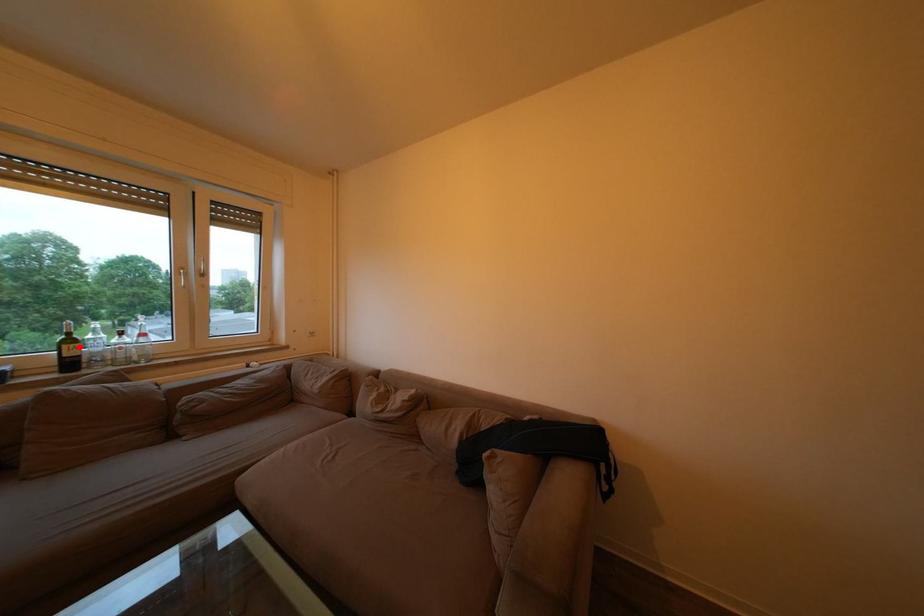
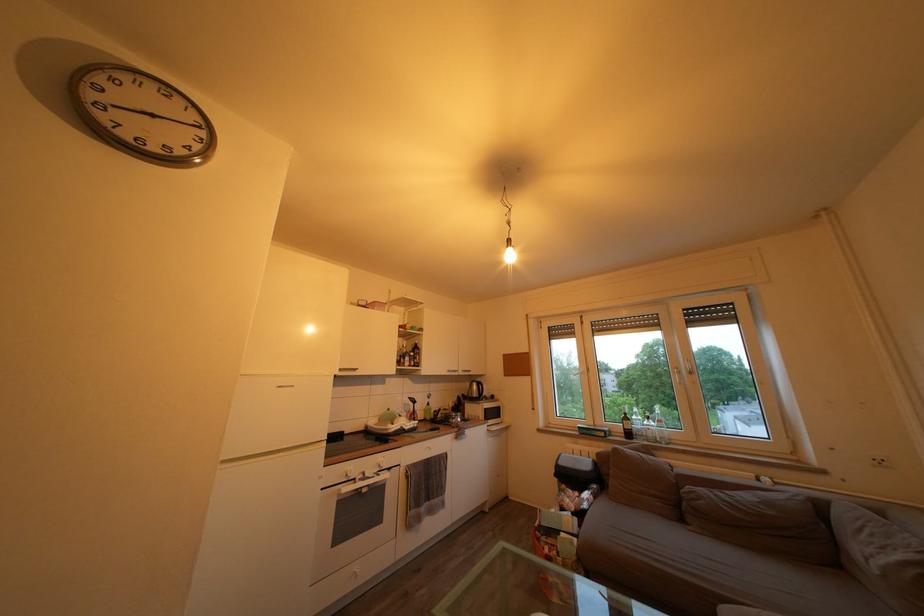
The point at the highlighted location is marked in the first image. Where is the corresponding point in the second image?

(635, 424)